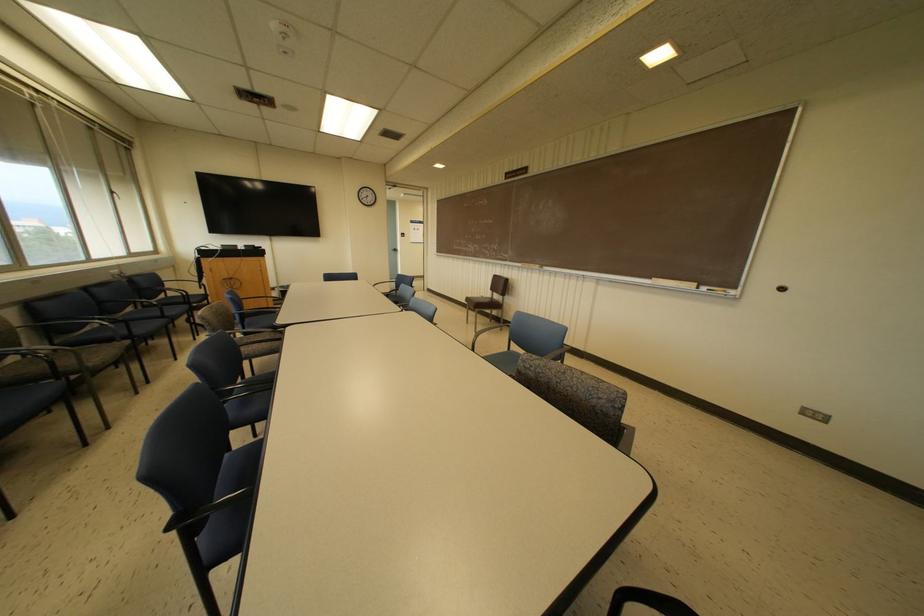
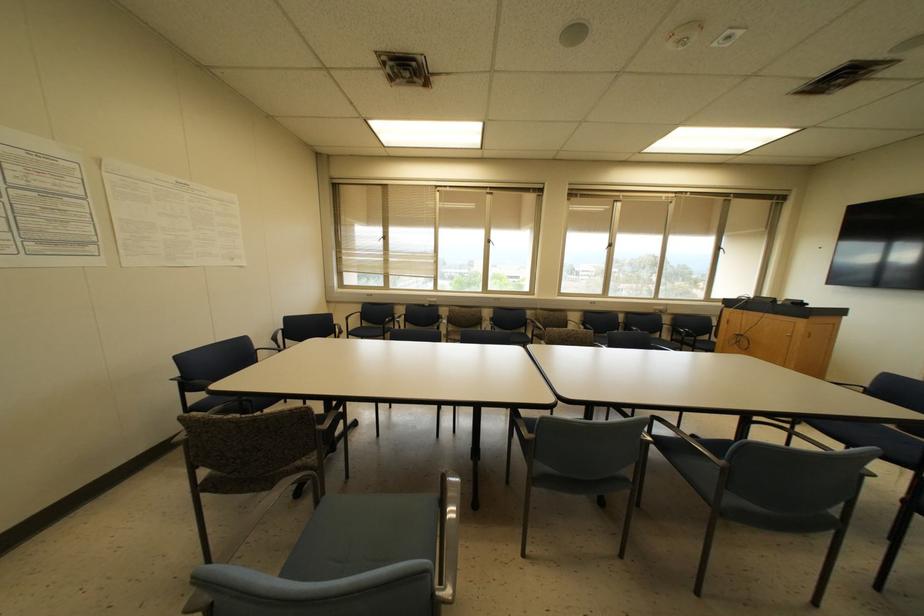
Question: I am providing you with two images of the same scene from different viewpoints. After the viewpoint changes to image2, which objects are now occluded?

Choices:
 (A) blue chair sitting surface
 (B) chair sitting surface
 (C) brown woven basket
 (D) chair armrest

Answer: (A)